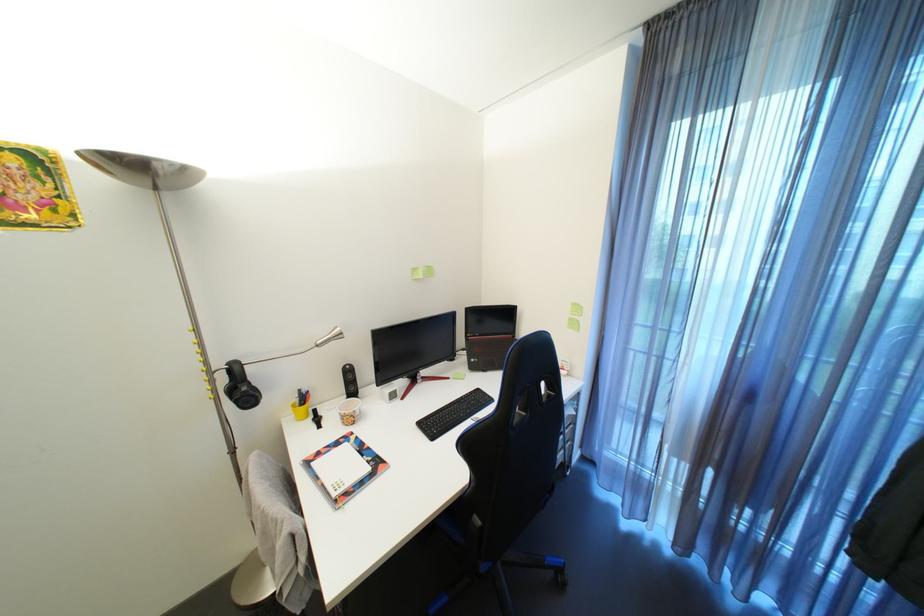
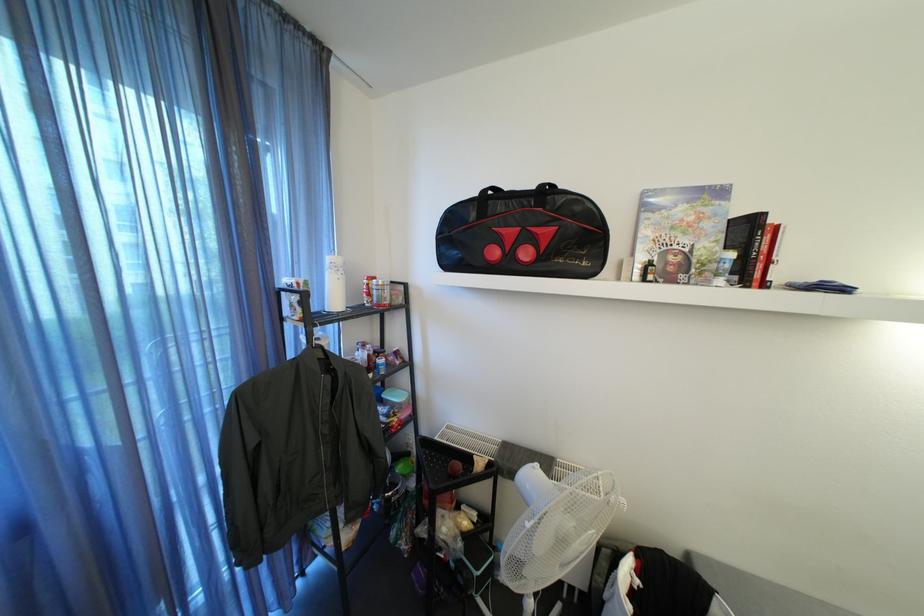
The first image is from the beginning of the video and the second image is from the end. How did the camera likely rotate when shooting the video?

The camera's rotation is toward right-down.